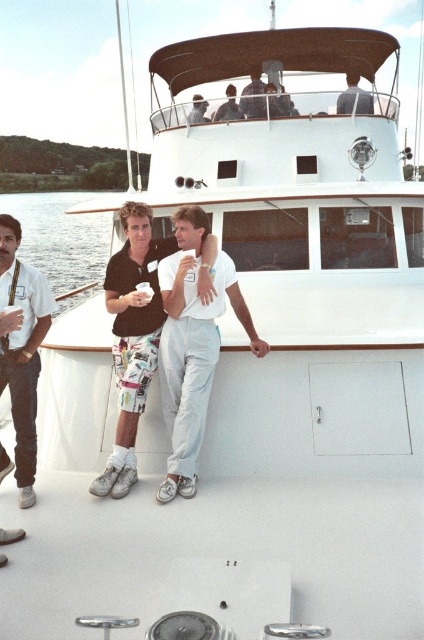
Question: Is white smooth deck at lower center smaller than matte black shirt at upper center?

Choices:
 (A) no
 (B) yes

Answer: (A)

Question: Based on their relative distances, which object is farther from the gray fabric shirt at upper center?

Choices:
 (A) white cotton shorts at center
 (B) matte black shirt at upper center

Answer: (A)

Question: Is white cotton shirt at left smaller than clear water at lower left?

Choices:
 (A) no
 (B) yes

Answer: (B)

Question: Which of the following is the closest to the observer?

Choices:
 (A) gray fabric shirt at upper center
 (B) white cotton shorts at center
 (C) white smooth deck at lower center

Answer: (C)

Question: Which is nearer to the white cotton shorts at center?

Choices:
 (A) white cotton shirt at center
 (B) white smooth deck at lower center
 (C) matte black shirt at upper center

Answer: (A)

Question: Is white smooth deck at lower center positioned behind white cotton shorts at center?

Choices:
 (A) no
 (B) yes

Answer: (A)